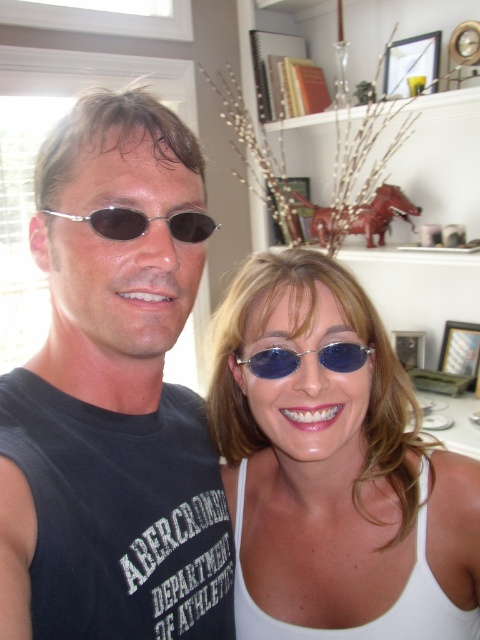
Is matte black sunglasses at center to the right of blue metallic sunglasses at center from the viewer's perspective?

Incorrect, matte black sunglasses at center is not on the right side of blue metallic sunglasses at center.

Does point (135, 449) lie behind point (359, 352)?

No, it is not.

You are a GUI agent. You are given a task and a screenshot of the screen. Output one action in this format:
    pyautogui.click(x=<x>, y=<y>)
    Task: Click on the matte black sunglasses at center
    This screenshot has height=640, width=480.
    Given the screenshot: What is the action you would take?
    pyautogui.click(x=113, y=394)

In order to click on matte black sunglasses at center in this screenshot , I will do `click(113, 394)`.

Between matte black sunglasses at center and satin white tank top at center, which one has more height?

Standing taller between the two is matte black sunglasses at center.

In the scene shown: Who is higher up, matte black sunglasses at center or satin white tank top at center?

matte black sunglasses at center is above.

Measure the distance between point (x=170, y=481) and camera.

Point (x=170, y=481) is 65.21 centimeters from camera.

Locate an element on the screen. The image size is (480, 640). matte black sunglasses at center is located at coordinates (113, 394).

Locate an element on the screen. satin white tank top at center is located at coordinates (334, 465).

Between satin white tank top at center and sunglasses at center, which one appears on the left side from the viewer's perspective?

sunglasses at center is more to the left.

Locate an element on the screen. The width and height of the screenshot is (480, 640). satin white tank top at center is located at coordinates (334, 465).